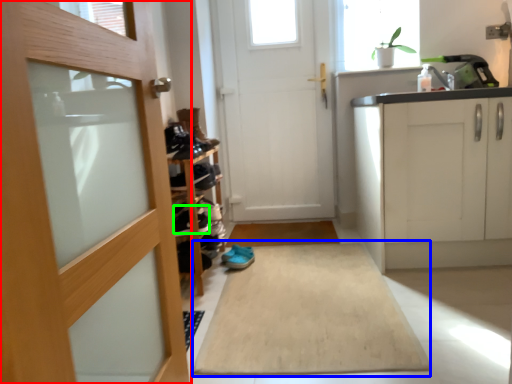
Question: Which object is the farthest from door (highlighted by a red box)? Choose among these: bath mat (highlighted by a blue box) or shoe (highlighted by a green box).

Choices:
 (A) bath mat
 (B) shoe

Answer: (B)